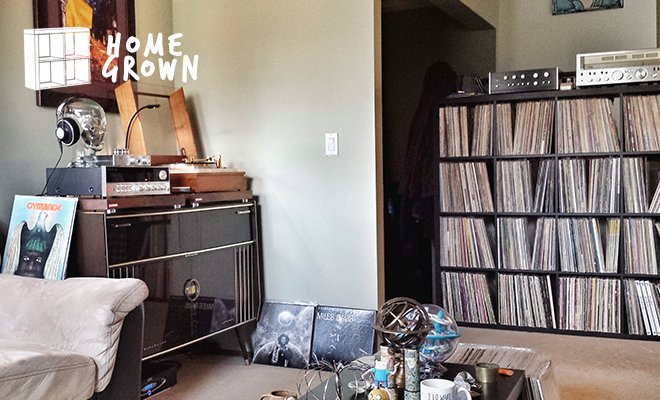
The image size is (660, 400). Find the location of `wall`. wall is located at coordinates (294, 62).